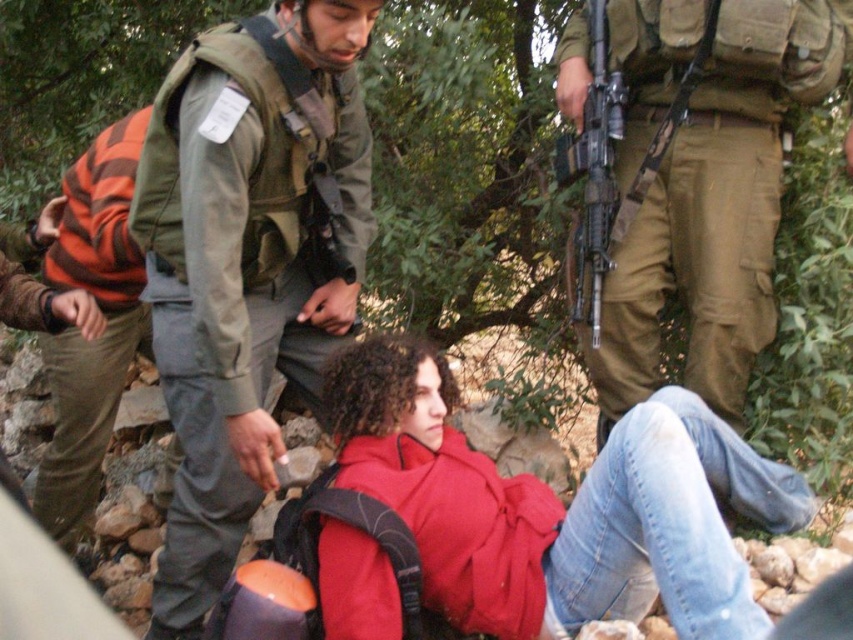
Does point (160, 224) lie in front of point (769, 132)?

Yes, it is.

Does green military uniform at center appear on the right side of camouflage fabric uniform at center?

No, green military uniform at center is not to the right of camouflage fabric uniform at center.

Is point (343, 330) in front of point (759, 90)?

No, it is behind (759, 90).

Locate an element on the screen. The height and width of the screenshot is (640, 853). green military uniform at center is located at coordinates (244, 266).

Between striped cotton shirt at left and matte black rifle at center, which one is positioned lower?

Positioned lower is striped cotton shirt at left.

Does point (93, 198) come behind point (613, 76)?

Yes, it is.

The image size is (853, 640). In order to click on striped cotton shirt at left in this screenshot , I will do `click(105, 324)`.

You are a GUI agent. You are given a task and a screenshot of the screen. Output one action in this format:
    pyautogui.click(x=<x>, y=<y>)
    Task: Click on the striped cotton shirt at left
    Image resolution: width=853 pixels, height=640 pixels.
    Given the screenshot: What is the action you would take?
    pyautogui.click(x=105, y=324)

Who is more distant from viewer, (341, 262) or (99, 403)?

Point (99, 403)

Does green military uniform at center have a lesser width compared to striped cotton shirt at left?

Incorrect, green military uniform at center's width is not less than striped cotton shirt at left's.

Between point (196, 518) and point (144, 115), which one is positioned behind?

The point (144, 115) is behind.

Locate an element on the screen. The width and height of the screenshot is (853, 640). green military uniform at center is located at coordinates (244, 266).